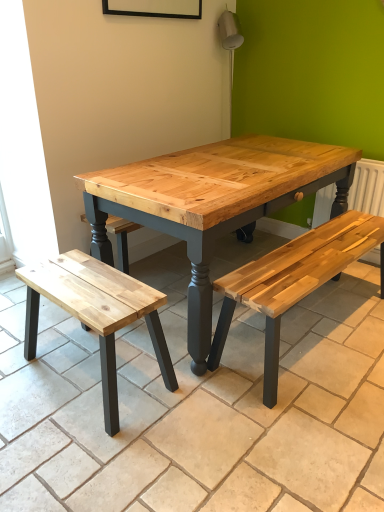
Measure the distance between white painted radiator at right and camera.

white painted radiator at right and camera are 2.30 meters apart from each other.

The width and height of the screenshot is (384, 512). I want to click on natural wood bench at lower left, so click(x=96, y=313).

The image size is (384, 512). In order to click on bench on the left of natural wood bench at lower right in this screenshot , I will do `click(96, 313)`.

Is natural wood bench at lower left inside natural wood bench at lower right?

No, natural wood bench at lower left is not inside natural wood bench at lower right.

Based on the photo, which of these two, natural wood bench at lower right or natural wood bench at lower left, is smaller?

natural wood bench at lower left is smaller.

Is white painted radiator at right in contact with natural wood bench at lower right?

No, white painted radiator at right is not making contact with natural wood bench at lower right.

Which object is positioned more to the right, white painted radiator at right or natural wood bench at lower right?

white painted radiator at right is more to the right.

Is natural wood bench at lower right completely or partially inside white painted radiator at right?

No.

Who is shorter, white painted radiator at right or natural wood bench at lower right?

natural wood bench at lower right is shorter.

Measure the distance from white painted radiator at right to natural wood bench at lower left.

white painted radiator at right and natural wood bench at lower left are 5.17 feet apart.

Between point (327, 199) and point (79, 288), which one is positioned behind?

The point (327, 199) is more distant.

Which is more to the right, white painted radiator at right or natural wood bench at lower left?

white painted radiator at right.

From the image's perspective, does white painted radiator at right appear higher than natural wood bench at lower left?

Indeed, from the image's perspective, white painted radiator at right is shown above natural wood bench at lower left.

From the image's perspective, would you say natural wood bench at lower left is shown under natural wood bench at lower right?

No, from the image's perspective, natural wood bench at lower left is not beneath natural wood bench at lower right.

Based on the photo, between natural wood bench at lower left and natural wood bench at lower right, which one has smaller width?

With smaller width is natural wood bench at lower left.

Where is `bench that appears above the natural wood bench at lower right (from a real-world perspective)`? Image resolution: width=384 pixels, height=512 pixels. bench that appears above the natural wood bench at lower right (from a real-world perspective) is located at coordinates (96, 313).

In terms of height, does natural wood bench at lower left look taller or shorter compared to white painted radiator at right?

In the image, natural wood bench at lower left appears to be shorter than white painted radiator at right.

Which is nearer, (134, 313) or (320, 209)?

The point (134, 313) is more forward.

Where is `bench lying in front of the white painted radiator at right`? The height and width of the screenshot is (512, 384). bench lying in front of the white painted radiator at right is located at coordinates (96, 313).

Based on the photo, in terms of height, does natural wood bench at lower right look taller or shorter compared to white painted radiator at right?

In the image, natural wood bench at lower right appears to be shorter than white painted radiator at right.

From the picture: Is natural wood bench at lower right positioned before white painted radiator at right?

Yes, it is in front of white painted radiator at right.

Is natural wood bench at lower right thinner than white painted radiator at right?

In fact, natural wood bench at lower right might be wider than white painted radiator at right.

From the image's perspective, does natural wood bench at lower right appear higher than white painted radiator at right?

No, from the image's perspective, natural wood bench at lower right is not above white painted radiator at right.

This screenshot has width=384, height=512. I want to click on bench lying on the left of natural wood bench at lower right, so click(96, 313).

Image resolution: width=384 pixels, height=512 pixels. I want to click on tile in front of the white painted radiator at right, so [x=197, y=407].

From the image, which object appears to be nearer to natural wood bench at lower right, natural wood bench at lower left or white painted radiator at right?

natural wood bench at lower left is positioned closer to the anchor natural wood bench at lower right.

Considering their positions, is natural wood bench at lower right positioned closer to white painted radiator at right than natural wood bench at lower left?

Among the two, natural wood bench at lower right is located nearer to white painted radiator at right.

From the image, which object appears to be nearer to natural wood bench at lower right, white painted radiator at right or natural wood bench at lower left?

The object closer to natural wood bench at lower right is natural wood bench at lower left.

When comparing their distances from natural wood bench at lower left, does natural wood bench at lower right or white painted radiator at right seem closer?

The object closer to natural wood bench at lower left is natural wood bench at lower right.

Which object lies further to the anchor point white painted radiator at right, natural wood bench at lower left or natural wood bench at lower right?

The object further to white painted radiator at right is natural wood bench at lower left.

Based on their spatial positions, is white painted radiator at right or natural wood bench at lower right further from natural wood bench at lower left?

white painted radiator at right lies further to natural wood bench at lower left than the other object.

Where is `bench between natural wood bench at lower right and white painted radiator at right in the front-back direction`? This screenshot has width=384, height=512. bench between natural wood bench at lower right and white painted radiator at right in the front-back direction is located at coordinates (96, 313).